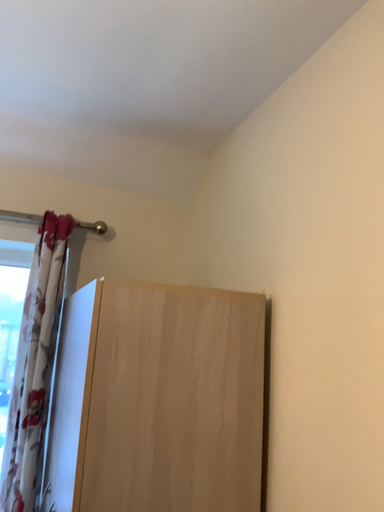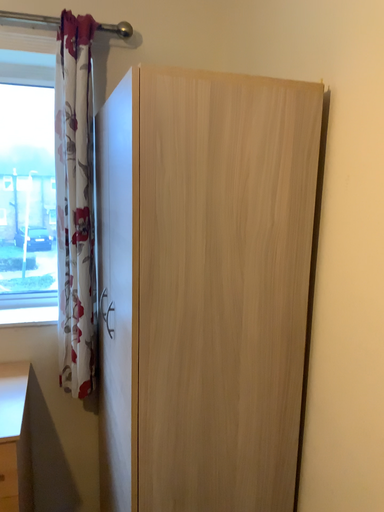
Question: Which way did the camera rotate in the video?

Choices:
 (A) rotated upward
 (B) rotated downward

Answer: (B)